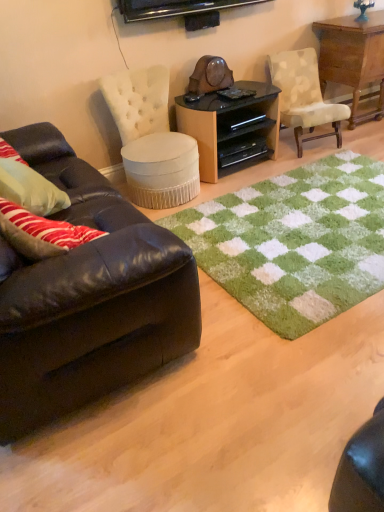
Question: In terms of height, does black glossy wood desk at center look taller or shorter compared to black plastic drawer at center, which is the 1th drawer from top to bottom?

Choices:
 (A) tall
 (B) short

Answer: (A)

Question: Is black glossy wood desk at center bigger or smaller than black plastic drawer at center, which is the 2th drawer in bottom-to-top order?

Choices:
 (A) small
 (B) big

Answer: (B)

Question: Which object is the farthest from the wooden table at upper right?

Choices:
 (A) white tufted fabric ottoman at center, the first chair positioned from the left
 (B) black plastic drawer at center, the 1th drawer positioned from the bottom
 (C) green shaggy rug at center
 (D) beige fabric chair at upper right, which is the 1th chair in right-to-left order
 (E) shiny brown leather couch at left

Answer: (E)

Question: Based on their relative distances, which object is nearer to the wooden table at upper right?

Choices:
 (A) white tufted fabric ottoman at center, which ranks as the second chair in right-to-left order
 (B) black plastic drawer at center, which is the 2th drawer in bottom-to-top order
 (C) beige fabric chair at upper right, which ranks as the 2th chair in left-to-right order
 (D) black glossy wood desk at center
 (E) black plastic drawer at center, the 1th drawer positioned from the bottom

Answer: (C)